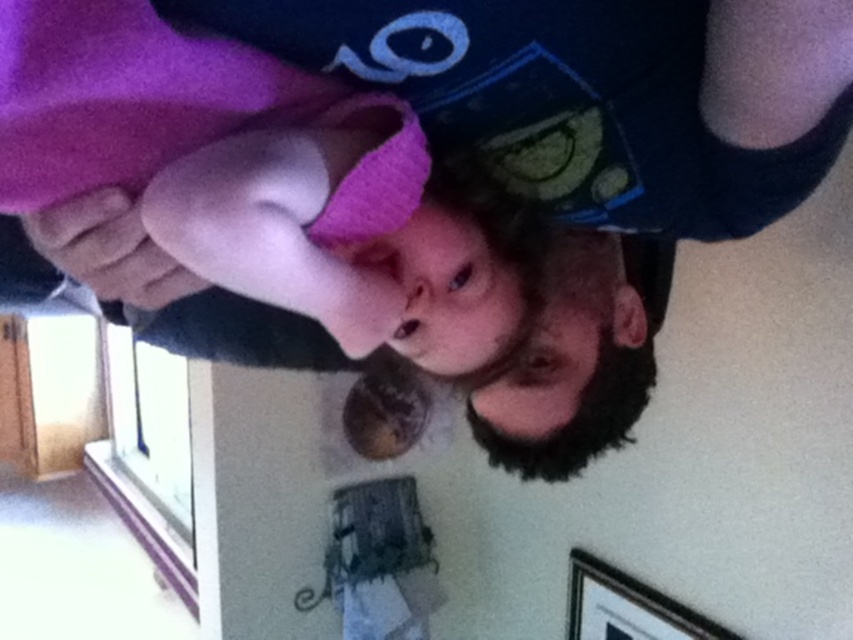
Question: Observing the image, what is the correct spatial positioning of purple fleece at upper left in reference to wooden picture frame at lower right?

Choices:
 (A) above
 (B) below

Answer: (A)

Question: Is purple fleece at upper left to the left of wooden picture frame at lower right from the viewer's perspective?

Choices:
 (A) yes
 (B) no

Answer: (A)

Question: Which of the following is the farthest from the observer?

Choices:
 (A) purple fleece at upper left
 (B) wooden picture frame at lower right

Answer: (B)

Question: Which point is farther to the camera?

Choices:
 (A) (259, 193)
 (B) (677, 628)

Answer: (B)

Question: Does purple fleece at upper left come behind wooden picture frame at lower right?

Choices:
 (A) yes
 (B) no

Answer: (B)